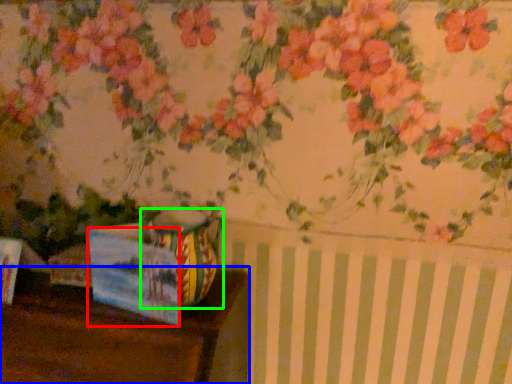
Question: Which is farther away from postcard (highlighted by a red box)? table (highlighted by a blue box) or vase (highlighted by a green box)?

Choices:
 (A) table
 (B) vase

Answer: (A)